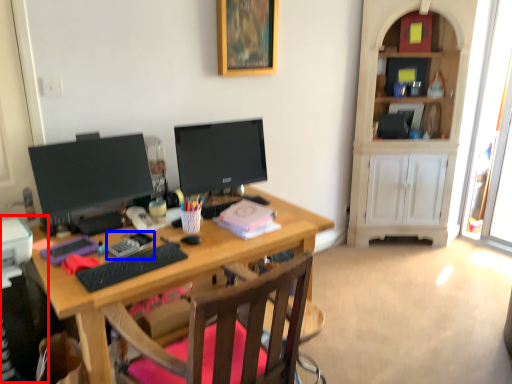
Question: Which of the following is the closest to the observer, computer tower (highlighted by a red box) or stationery (highlighted by a blue box)?

Choices:
 (A) computer tower
 (B) stationery

Answer: (A)